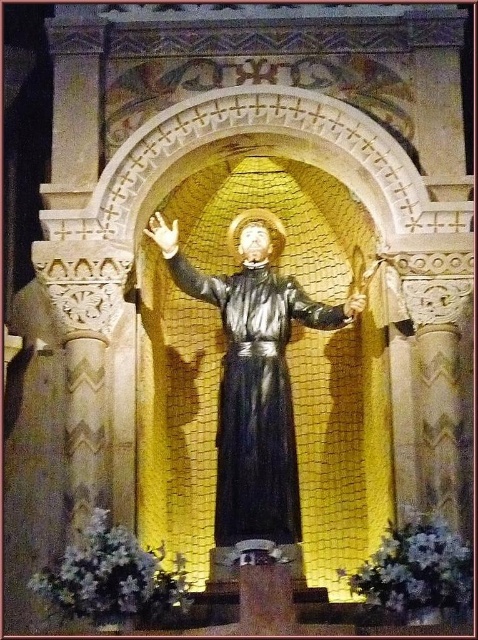
Question: Can you confirm if matte white hand at center is positioned below matte gold chain at upper center?

Choices:
 (A) yes
 (B) no

Answer: (B)

Question: Which point appears closest to the camera in this image?

Choices:
 (A) (234, 275)
 (B) (346, 314)
 (C) (162, 234)

Answer: (C)

Question: Which is nearer to the black matte robe at center?

Choices:
 (A) matte gold chain at upper center
 (B) matte white hand at center

Answer: (A)

Question: Which object appears closest to the camera in this image?

Choices:
 (A) matte white hand at center
 (B) matte gold chain at upper center
 (C) black matte robe at center

Answer: (C)

Question: Does black matte robe at center have a smaller size compared to matte white hand at center?

Choices:
 (A) no
 (B) yes

Answer: (A)

Question: Does black matte robe at center appear under matte white hand at center?

Choices:
 (A) no
 (B) yes

Answer: (B)